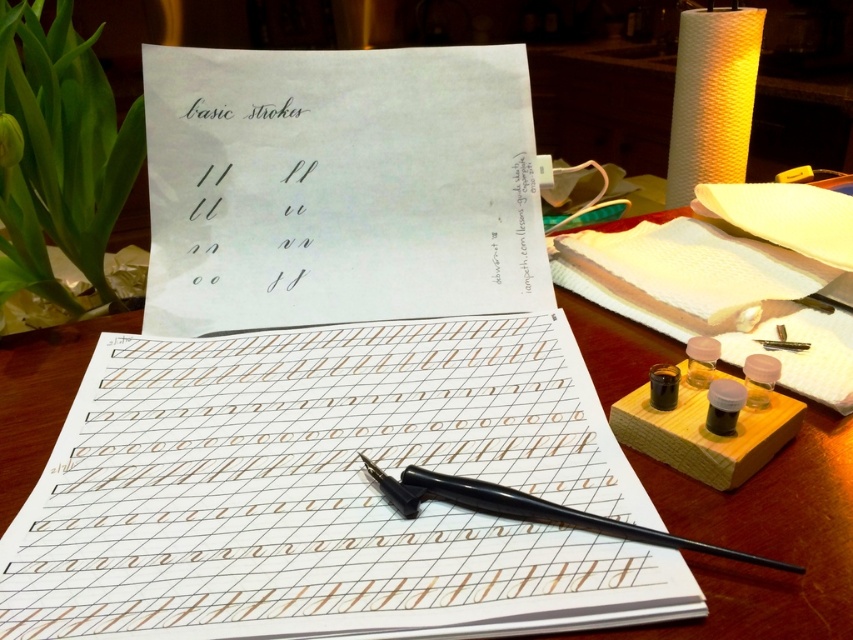
Question: Which object appears closest to the camera in this image?

Choices:
 (A) black glossy ink at lower right
 (B) black metal pen at center
 (C) translucent plastic ink bottles at lower right
 (D) black glossy ink bottle at lower right

Answer: (B)

Question: Which point appears farthest from the camera in this image?

Choices:
 (A) (701, 353)
 (B) (703, 83)

Answer: (B)

Question: Which point is farther to the camera?

Choices:
 (A) translucent plastic ink bottles at lower right
 (B) black glossy ink bottle at lower right
 (C) black ink writing at upper center

Answer: (C)

Question: Is matte yellow paper at upper right further to camera compared to translucent amber glass inkwell at center right?

Choices:
 (A) yes
 (B) no

Answer: (A)

Question: Can you confirm if black ink writing at upper center is bigger than black smooth pen at center?

Choices:
 (A) yes
 (B) no

Answer: (A)

Question: Can you confirm if brown paper notebook at center is wider than black metal pen at center?

Choices:
 (A) no
 (B) yes

Answer: (B)